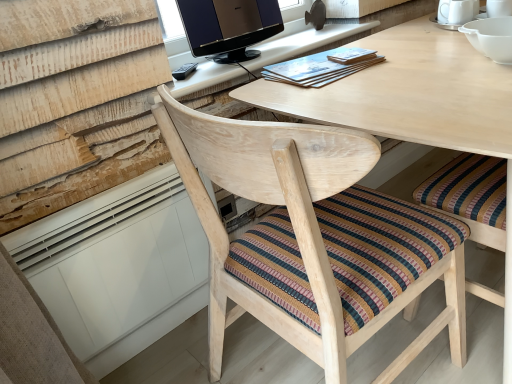
Question: Is matte brown book at upper center, the first book positioned from the right, wider or thinner than light wood computer desk at upper center?

Choices:
 (A) thin
 (B) wide

Answer: (A)

Question: From the image's perspective, is matte brown book at upper center, the 2th book from the left, above or below light wood computer desk at upper center?

Choices:
 (A) below
 (B) above

Answer: (A)

Question: Estimate the real-world distances between objects in this image. Which object is farther from the matte wooden book at upper center, the 2th book in the right-to-left sequence?

Choices:
 (A) matte brown book at upper center, the 2th book from the left
 (B) natural wood chair at center
 (C) satin black monitor at upper center
 (D) light wood computer desk at upper center

Answer: (B)

Question: Considering the real-world distances, which object is farthest from the satin black monitor at upper center?

Choices:
 (A) matte wooden book at upper center, the 2th book in the right-to-left sequence
 (B) natural wood chair at center
 (C) light wood computer desk at upper center
 (D) matte brown book at upper center, the 2th book from the left

Answer: (B)